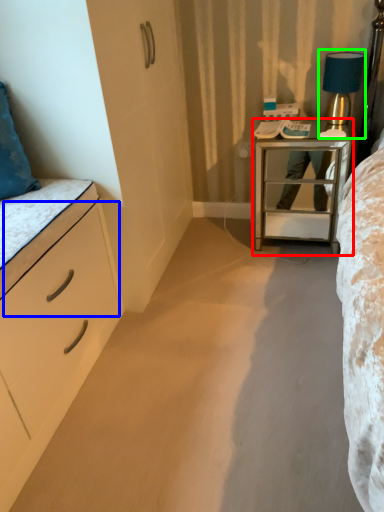
Question: Estimate the real-world distances between objects in this image. Which object is closer to nightstand (highlighted by a red box), drawer (highlighted by a blue box) or bedside lamp (highlighted by a green box)?

Choices:
 (A) drawer
 (B) bedside lamp

Answer: (B)